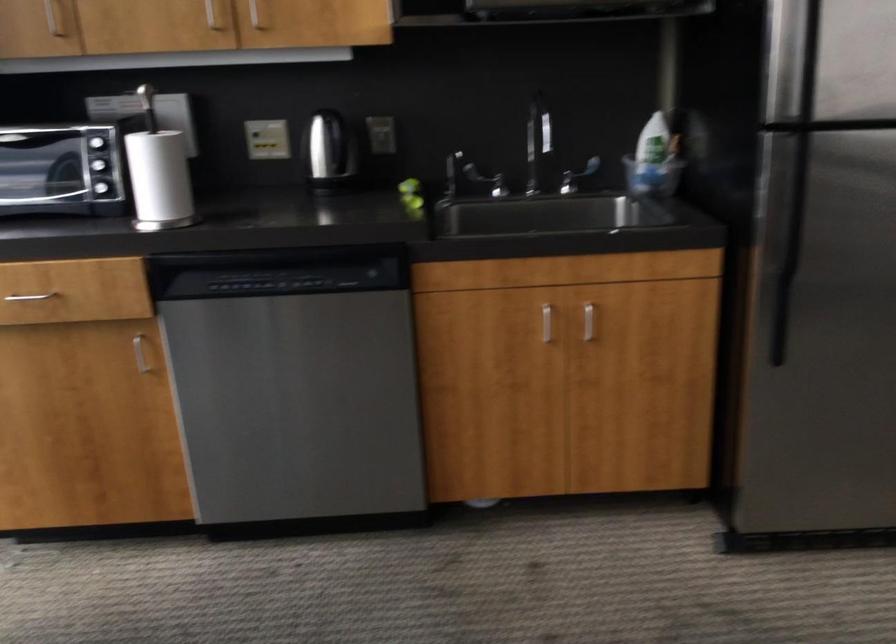
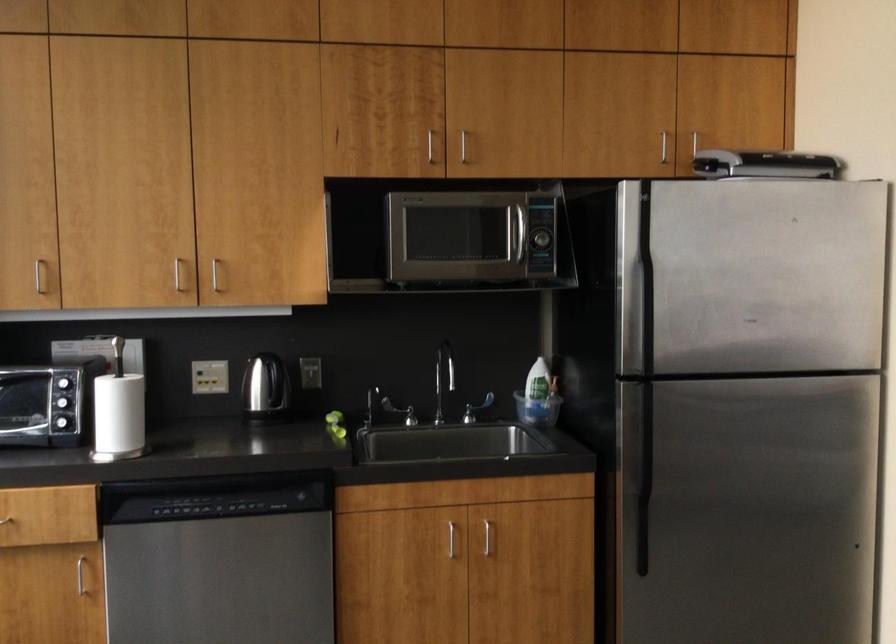
In the second image, find the point that corresponds to the point at 590,325 in the first image.

(490, 542)